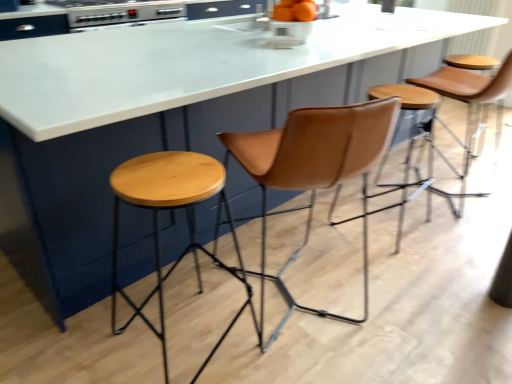
Locate an element on the screen. free spot to the left of leather stool at center, the second stool positioned from the left is located at coordinates (307, 220).